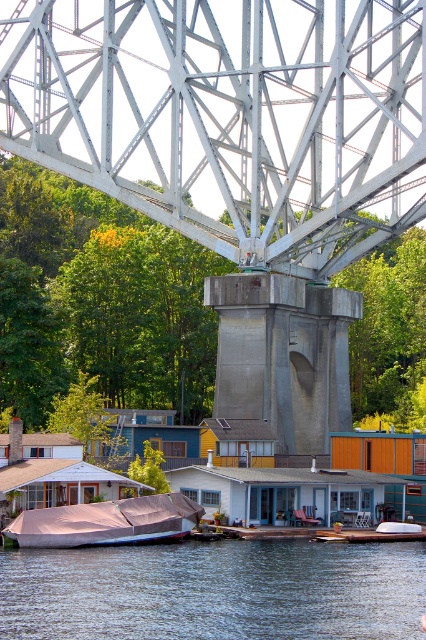
In the scene shown: You are standing on the lakeside and see the blue water at lower center and the matte pink tarp at lower left. Which object is located below the other?

The blue water at lower center is positioned under the matte pink tarp at lower left, so the blue water is below the matte pink tarp.

You are a photographer planning to capture a wide shot of the metallic gray bridge at center and the matte pink tarp at lower left. Given their sizes, which object should you prioritize framing first to ensure both are visible in the shot?

The metallic gray bridge at center is bigger than the matte pink tarp at lower left, so you should prioritize framing the metallic gray bridge at center first to ensure both objects fit in the shot.